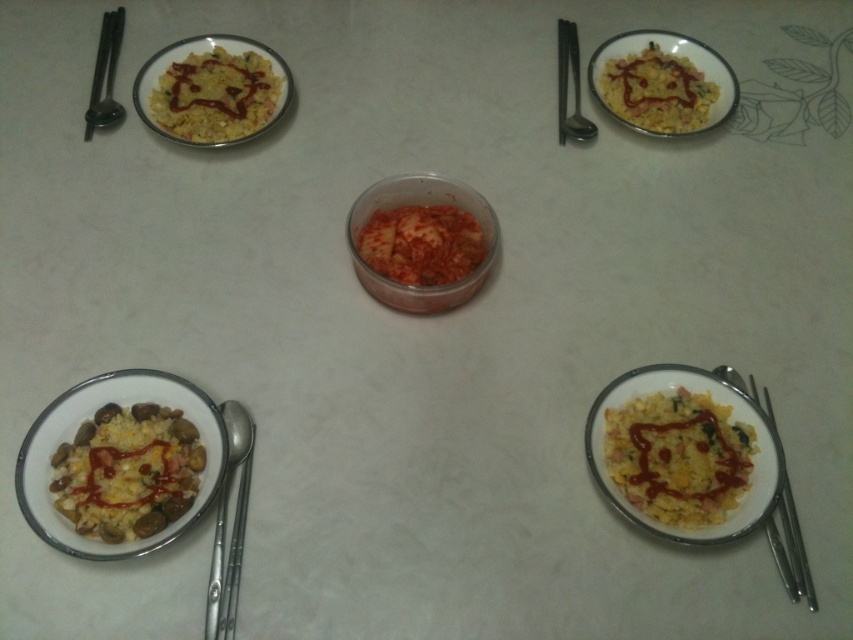
You are looking at the table setup with the bowls and the central container. There are two points marked on the table surface at coordinates point (741,451) and point (749,381). If you were to place a small napkin on the table, which point would require the napkin to be closer to you to be placed correctly?

Point (741,451) is closer to the viewer than point (749,381), so placing the napkin at point (741,451) would require it to be closer to you.

You are a food photographer setting up a still life shot. You have the yellow matte rice at bottom right and the silver metallic chopsticks at upper left on the table. To ensure proper composition, you need to know which item is smaller. Which one should you adjust in your setup?

The yellow matte rice at bottom right is smaller compared to the silver metallic chopsticks at upper left, so you should adjust the yellow matte rice at bottom right to balance the composition.

You are a food stylist arranging items on a table. You have a yellow matte rice at bottom right and silver chopsticks at bottom right. You need to place a small decorative flower between them. What is the minimum distance the flower should be placed from each item to ensure it fits between them?

The yellow matte rice at bottom right and silver chopsticks at bottom right are 5.68 centimeters apart from each other. To fit the flower between them, it should be placed at least 2.84 centimeters away from each item, which is half of the total distance between them.